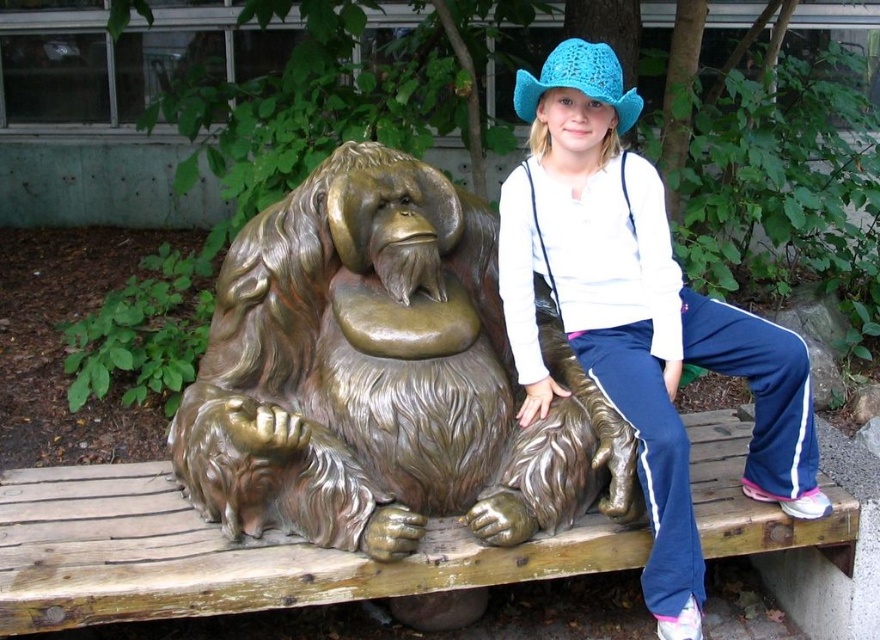
Who is positioned more to the right, bronze statue at center or crochet blue hat at upper right?

crochet blue hat at upper right

Between point (478, 260) and point (573, 36), which one is positioned behind?

The point (573, 36) is behind.

This screenshot has width=880, height=640. Find the location of `bronze statue at center`. bronze statue at center is located at coordinates (380, 376).

Is bronze statue at center taller than blue knitted hat at upper right?

Incorrect, bronze statue at center's height is not larger of blue knitted hat at upper right's.

Can you confirm if bronze statue at center is bigger than blue knitted hat at upper right?

Yes.

Which is behind, point (368, 220) or point (624, 356)?

Positioned behind is point (368, 220).

I want to click on bronze statue at center, so click(380, 376).

Can you confirm if blue knitted hat at upper right is positioned to the left of crochet blue hat at upper right?

No, blue knitted hat at upper right is not to the left of crochet blue hat at upper right.

Does blue knitted hat at upper right have a larger size compared to crochet blue hat at upper right?

Yes, blue knitted hat at upper right is bigger than crochet blue hat at upper right.

The width and height of the screenshot is (880, 640). Identify the location of blue knitted hat at upper right. (638, 316).

At what (x,y) coordinates should I click in order to perform the action: click on blue knitted hat at upper right. Please return your answer as a coordinate pair (x, y). The height and width of the screenshot is (640, 880). Looking at the image, I should click on (638, 316).